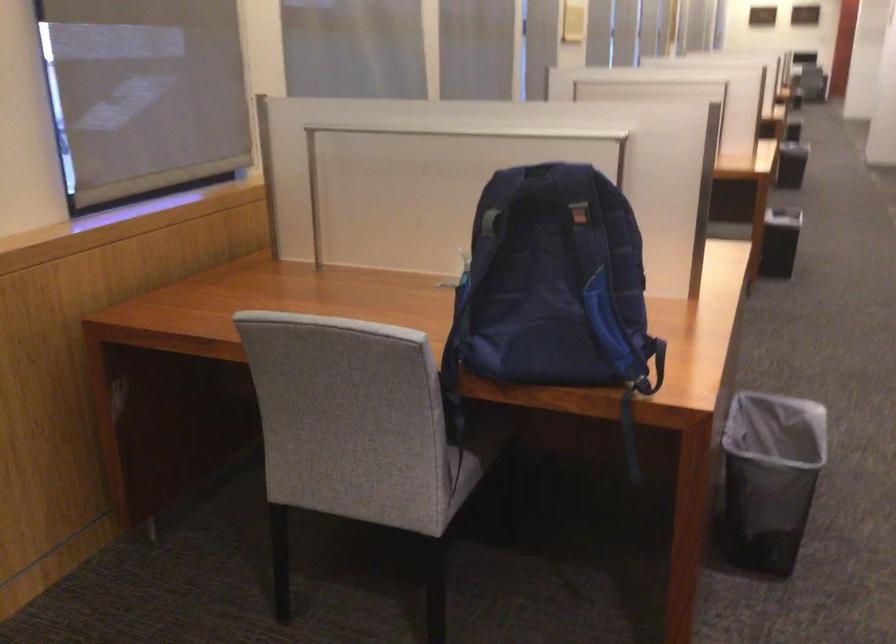
Identify the location of blue backpack. (552, 281).